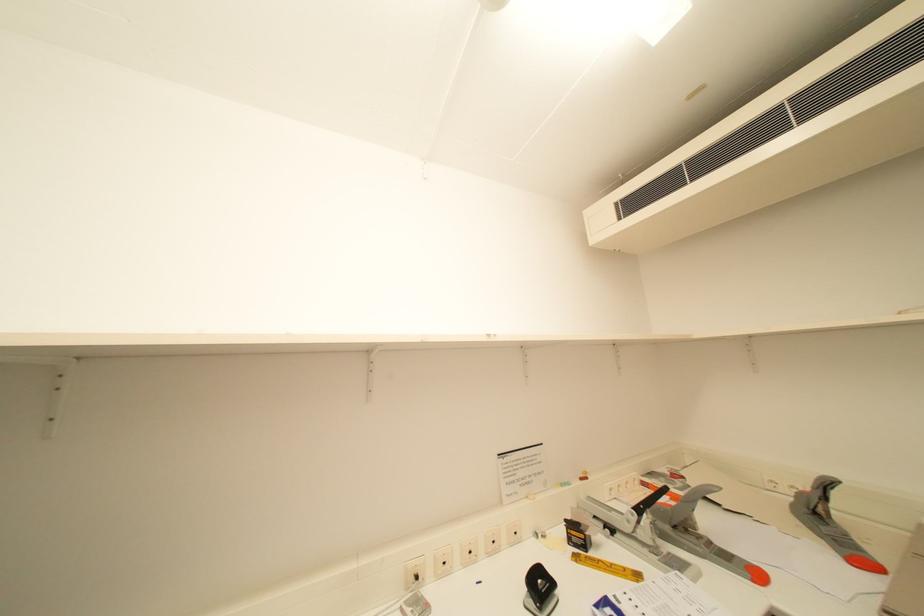
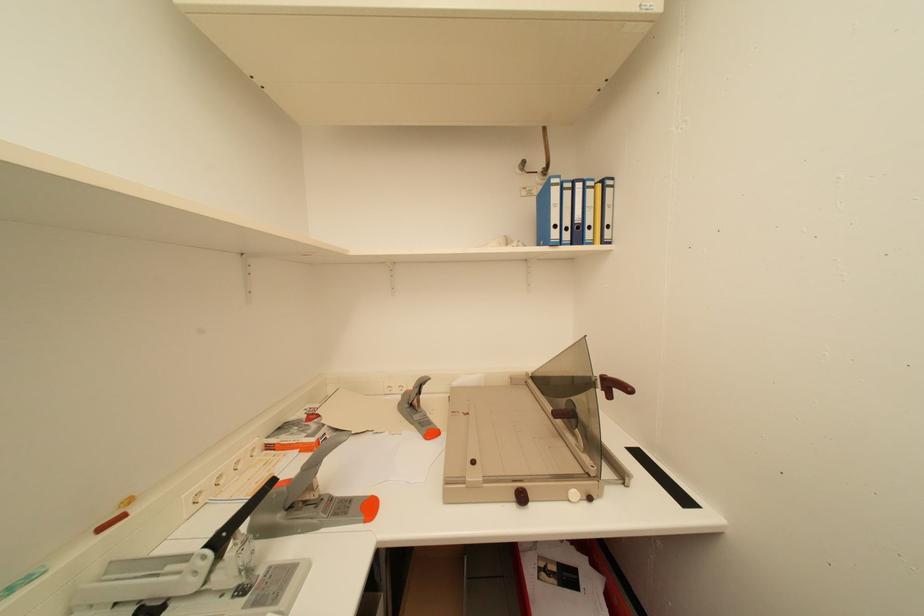
Question: How did the camera likely rotate?

Choices:
 (A) Left
 (B) Right
 (C) Up
 (D) Down

Answer: (B)